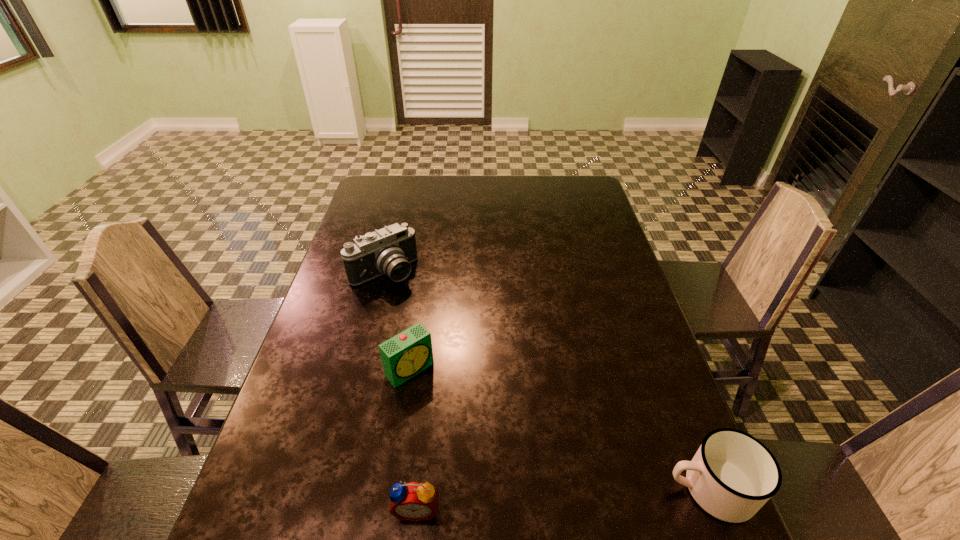
This screenshot has height=540, width=960. I want to click on free space on the desktop that is between the nearer alarm clock and the mug and is positioned on the front-facing side of the tallest object, so click(585, 497).

You are a GUI agent. You are given a task and a screenshot of the screen. Output one action in this format:
    pyautogui.click(x=<x>, y=<y>)
    Task: Click on the free space on the desktop that is between the nearer alarm clock and the mug and is positioned on the front-facing side of the second farthest object
    This screenshot has width=960, height=540.
    Given the screenshot: What is the action you would take?
    pyautogui.click(x=526, y=501)